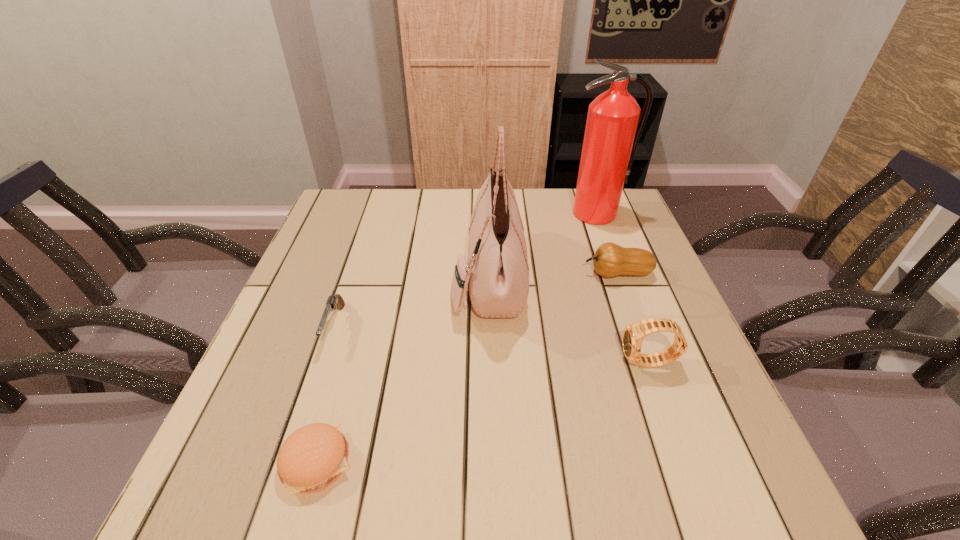
I want to click on the farthest object, so click(611, 136).

Locate an element on the screen. This screenshot has height=540, width=960. the third object from left to right is located at coordinates (498, 272).

You are a GUI agent. You are given a task and a screenshot of the screen. Output one action in this format:
    pyautogui.click(x=<x>, y=<y>)
    Task: Click on the third tallest object
    
    Given the screenshot: What is the action you would take?
    pyautogui.click(x=633, y=335)

Locate an element on the screen. Image resolution: width=960 pixels, height=540 pixels. gourd is located at coordinates (610, 260).

The height and width of the screenshot is (540, 960). What are the coordinates of `the second shortest object` in the screenshot? It's located at (333, 300).

Locate an element on the screen. The image size is (960, 540). the shortest object is located at coordinates (314, 456).

Find the location of a particular element. This screenshot has width=960, height=540. the nearest object is located at coordinates (314, 456).

Locate an element on the screen. The image size is (960, 540). blank space located at the nozzle of the farthest object is located at coordinates (635, 320).

This screenshot has width=960, height=540. I want to click on free space located on the side of the fourth object from right to left with the attached pouch, so click(393, 278).

Locate an element on the screen. The image size is (960, 540). free space located 0.390m on the side of the fourth object from right to left with the attached pouch is located at coordinates (298, 278).